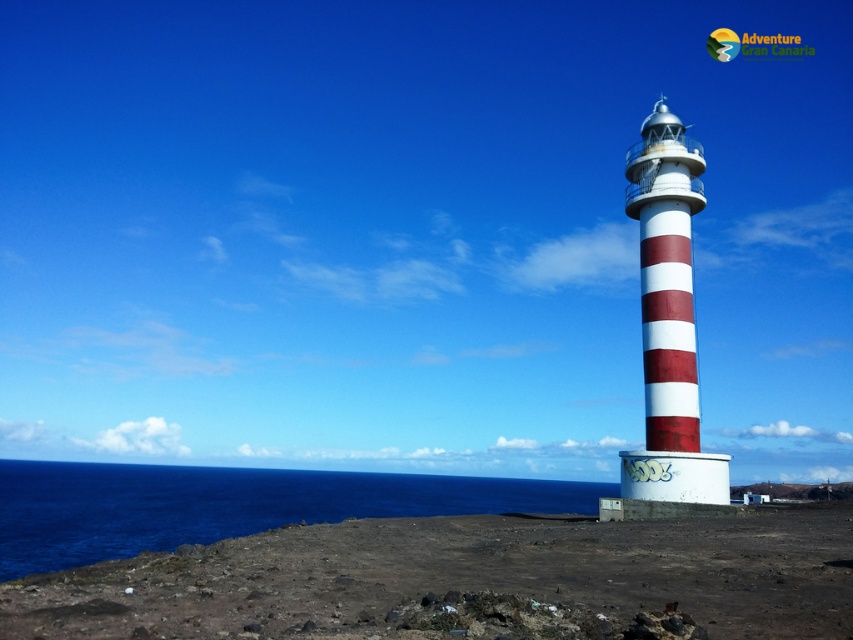
You are a bird flying over the rugged landscape. You see the deep blue water at lower left and the red and white striped tower at right. Which direction should you head to reach the water from the tower?

The deep blue water at lower left is to the left of the red and white striped tower at right, so to reach the water from the tower, you should head to the left.

You are a hiker who has just arrived at the base of the lighthouse and wants to cross from the brown rocky shore at lower right to the red and white striped tower at right. Which path would you take if you want to avoid the widest part?

You should cross towards the red and white striped tower at right since the brown rocky shore at lower right might be wider, making it harder to traverse.